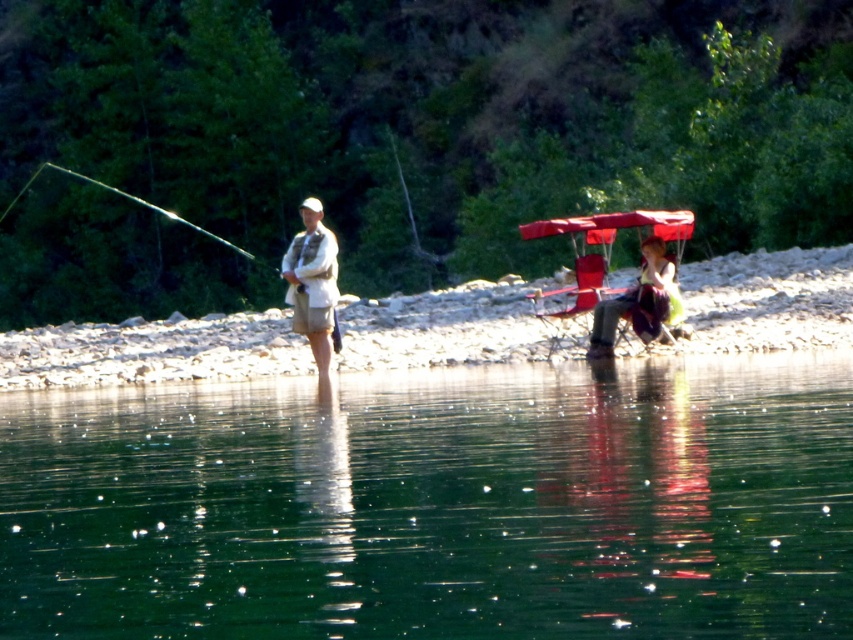
Who is positioned more to the left, smooth sand shore at center or matte white shirt at center?

matte white shirt at center is more to the left.

Is point (751, 284) in front of point (308, 212)?

No, (751, 284) is behind (308, 212).

Is point (697, 346) positioned behind point (321, 278)?

No, it is not.

In order to click on smooth sand shore at center in this screenshot , I will do `click(152, 352)`.

Does matte red folding chair at right appear on the right side of matte white shirt at center?

Yes, matte red folding chair at right is to the right of matte white shirt at center.

Which is behind, point (630, 289) or point (293, 276)?

Positioned behind is point (293, 276).

From the picture: Who is more forward, (607, 227) or (294, 326)?

Point (607, 227) is in front.

Where is `matte red folding chair at right`? matte red folding chair at right is located at coordinates (607, 269).

Can you confirm if smooth sand shore at center is taller than matte red folding chair at right?

Correct, smooth sand shore at center is much taller as matte red folding chair at right.

Does point (352, 360) come farther from viewer compared to point (648, 323)?

Yes, it is.

Locate an element on the screen. Image resolution: width=853 pixels, height=640 pixels. smooth sand shore at center is located at coordinates (152, 352).